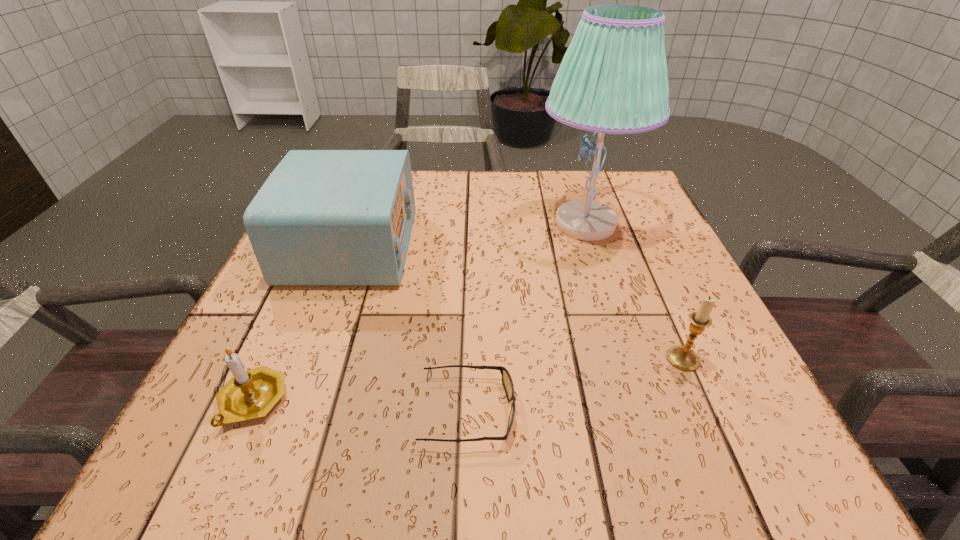
This screenshot has width=960, height=540. Identify the location of vacant space that's between the right candle holder and the left candle holder. pos(468,380).

Locate an element on the screen. This screenshot has height=540, width=960. vacant area between the radio receiver and the sunglasses is located at coordinates (410, 328).

At what (x,y) coordinates should I click in order to perform the action: click on vacant area that lies between the fourth shortest object and the third object from left to right. Please return your answer as a coordinate pair (x, y). The image size is (960, 540). Looking at the image, I should click on (410, 328).

You are a GUI agent. You are given a task and a screenshot of the screen. Output one action in this format:
    pyautogui.click(x=<x>, y=<y>)
    Task: Click on the vacant region between the third shortest object and the tallest object
    The height and width of the screenshot is (540, 960).
    Given the screenshot: What is the action you would take?
    pyautogui.click(x=634, y=291)

Identify the location of free area in between the tallest object and the radio receiver. This screenshot has width=960, height=540. (468, 235).

Locate an element on the screen. vacant space that's between the lamp and the taller candle holder is located at coordinates (634, 291).

Locate an element on the screen. This screenshot has width=960, height=540. empty space that is in between the tallest object and the taller candle holder is located at coordinates (634, 291).

This screenshot has height=540, width=960. I want to click on free space between the fourth shortest object and the shorter candle holder, so click(301, 324).

Locate an element on the screen. The image size is (960, 540). the third closest object to the left candle holder is located at coordinates (613, 79).

Find the location of a particular element. object that stands as the third closest to the tallest object is located at coordinates (507, 382).